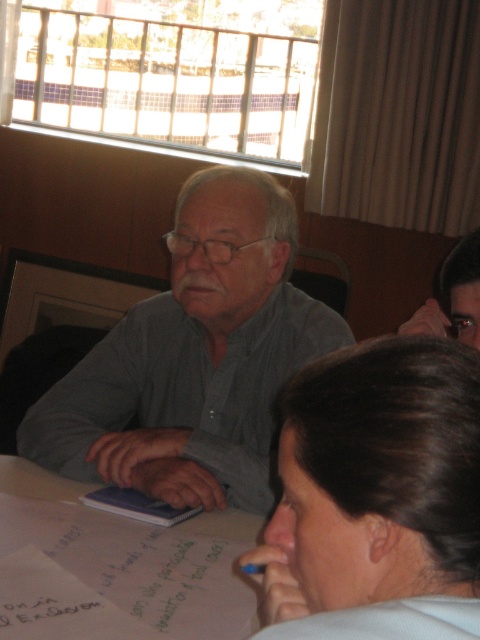
Question: Where is gray shirt at center located in relation to white paper at center in the image?

Choices:
 (A) below
 (B) above

Answer: (B)

Question: Which object appears closest to the camera in this image?

Choices:
 (A) gray shirt at center
 (B) white paper at center

Answer: (B)

Question: Is gray shirt at center closer to camera compared to dark brown hair at center?

Choices:
 (A) yes
 (B) no

Answer: (B)

Question: Which point is closer to the camera?

Choices:
 (A) (84, 486)
 (B) (108, 452)
 (C) (379, 465)

Answer: (C)

Question: Estimate the real-world distances between objects in this image. Which object is closer to the gray shirt at center?

Choices:
 (A) white paper at center
 (B) dark brown hair at center

Answer: (A)

Question: Can you confirm if gray shirt at center is wider than dark brown hair at center?

Choices:
 (A) no
 (B) yes

Answer: (B)